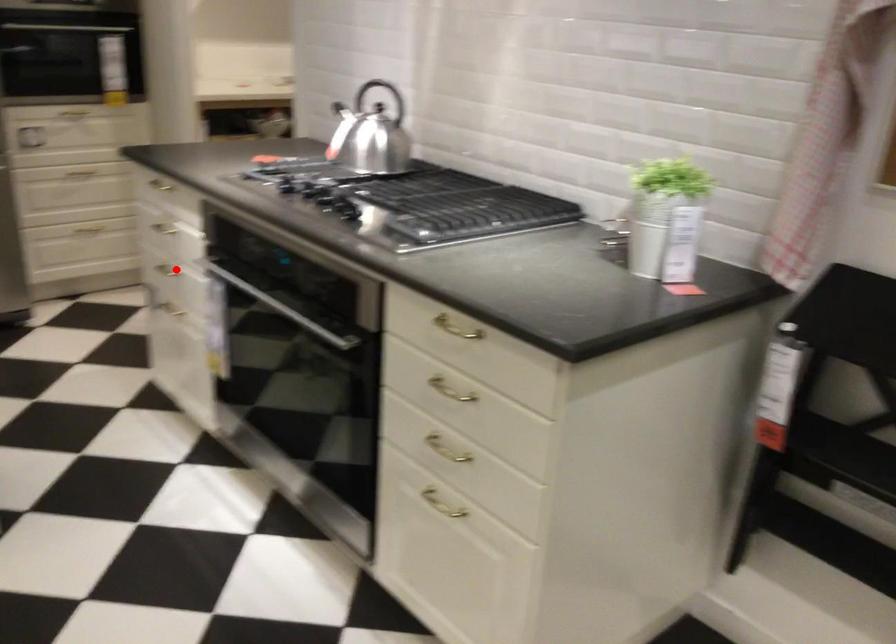
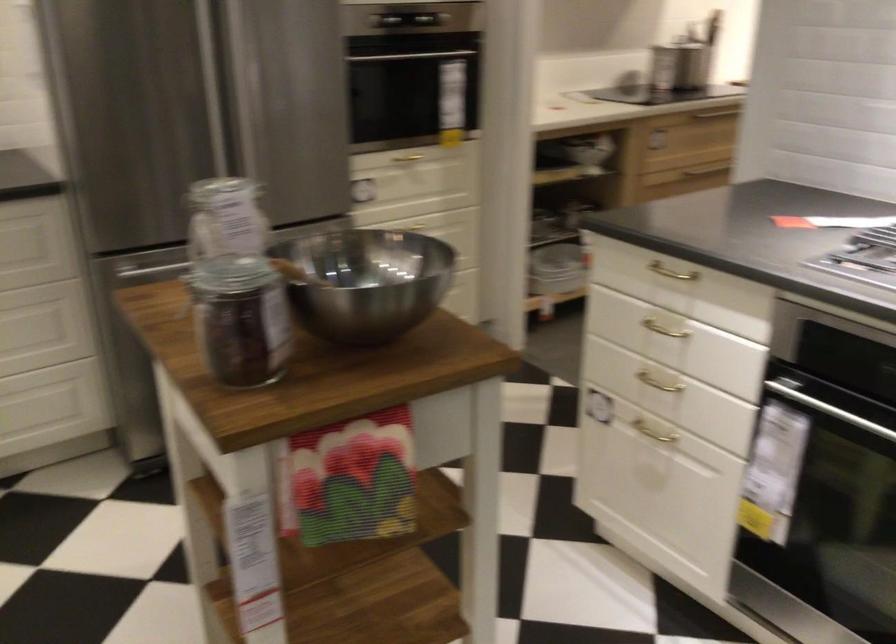
In the second image, find the point that corresponds to the highlighted location in the first image.

(659, 383)